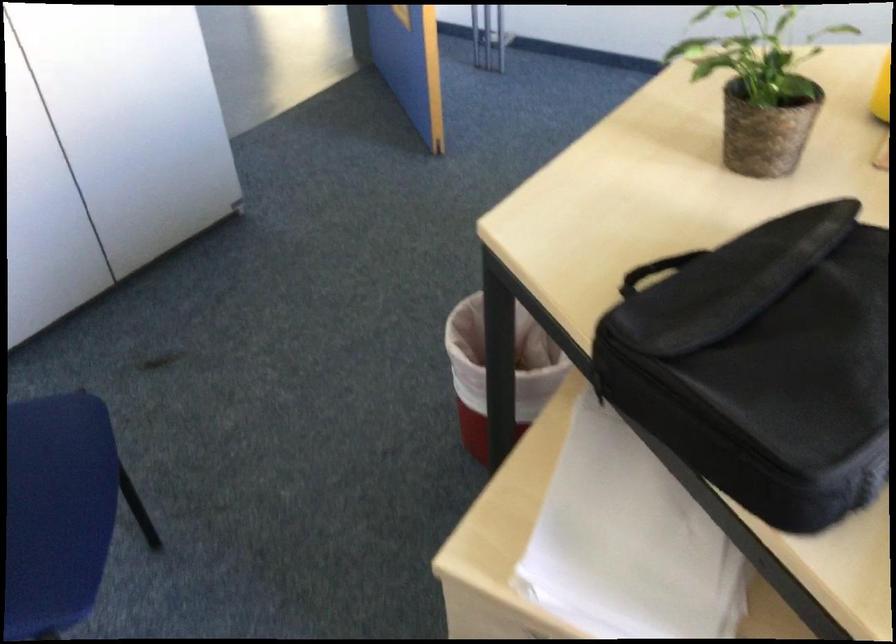
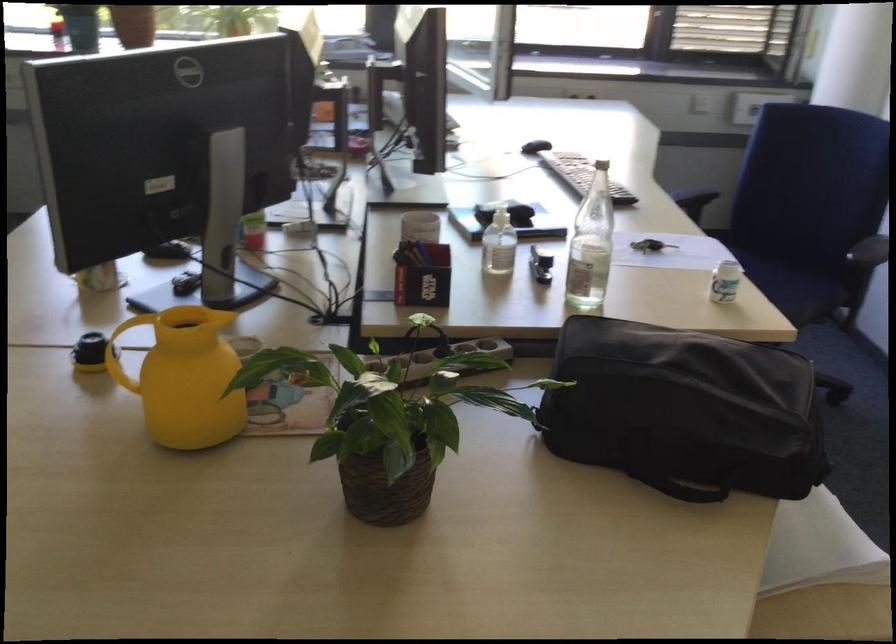
Where in the second image is the point corresponding to point (642, 371) from the first image?

(694, 491)